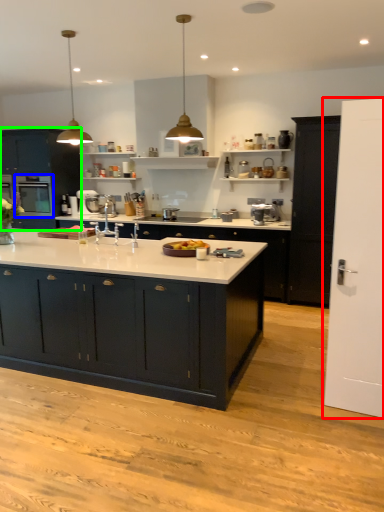
Question: Considering the real-world distances, which object is closest to door (highlighted by a red box)? home appliance (highlighted by a blue box) or cabinetry (highlighted by a green box).

Choices:
 (A) home appliance
 (B) cabinetry

Answer: (A)